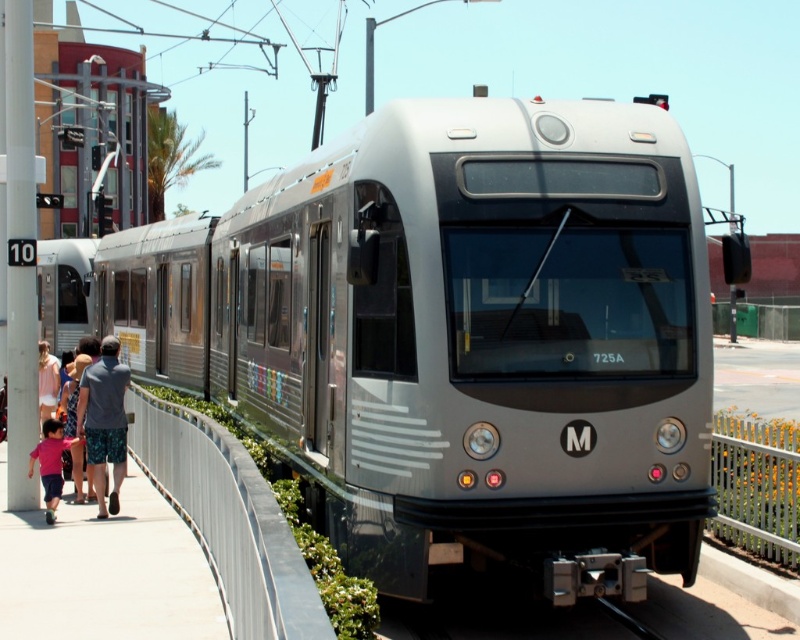
Question: Which of the following is the closest to the observer?

Choices:
 (A) matte pink shirt at lower left
 (B) gray cotton shorts at lower left

Answer: (B)

Question: Which of these objects is positioned farthest from the matte pink shirt at lower left?

Choices:
 (A) gray cotton shorts at lower left
 (B) pink fabric shirt at lower left
 (C) satin silver train at center

Answer: (C)

Question: Can you confirm if gray cotton shorts at lower left is wider than pink fabric shirt at lower left?

Choices:
 (A) no
 (B) yes

Answer: (B)

Question: Does gray cotton shorts at lower left have a lesser width compared to pink fabric shirt at lower left?

Choices:
 (A) yes
 (B) no

Answer: (B)

Question: Can you confirm if satin silver train at center is smaller than gray cotton shorts at lower left?

Choices:
 (A) yes
 (B) no

Answer: (B)

Question: Which of the following is the farthest from the observer?

Choices:
 (A) satin silver train at center
 (B) gray cotton shorts at lower left

Answer: (B)